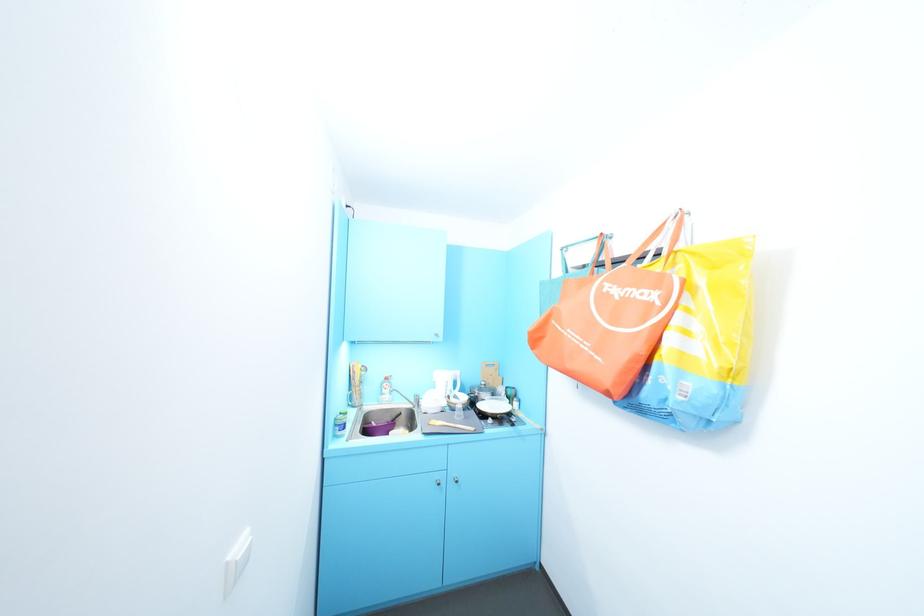
What do you see at coordinates (432, 400) in the screenshot?
I see `the white kettle handle` at bounding box center [432, 400].